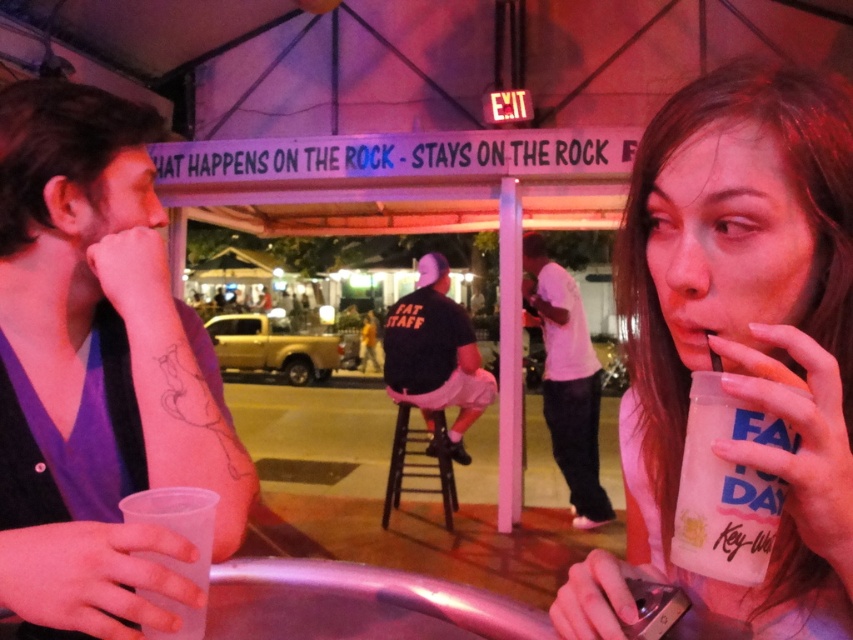
Question: Does white matte shirt at center appear over wooden stool at center?

Choices:
 (A) no
 (B) yes

Answer: (B)

Question: Is white paper cup at lower right thinner than wooden stool at center?

Choices:
 (A) no
 (B) yes

Answer: (B)

Question: Observing the image, what is the correct spatial positioning of white paper cup at lower right in reference to black fabric shirt at center?

Choices:
 (A) below
 (B) above

Answer: (B)

Question: Estimate the real-world distances between objects in this image. Which object is closer to the white paper cup at lower right?

Choices:
 (A) black fabric shirt at center
 (B) clear plastic cup at left
 (C) wooden stool at center

Answer: (B)

Question: Which of the following is the closest to the observer?

Choices:
 (A) (730, 81)
 (B) (199, 342)
 (C) (396, 416)
 (D) (401, 305)

Answer: (A)

Question: Which of the following is the closest to the observer?

Choices:
 (A) (381, 512)
 (B) (833, 324)
 (C) (436, 404)
 (D) (181, 355)

Answer: (B)